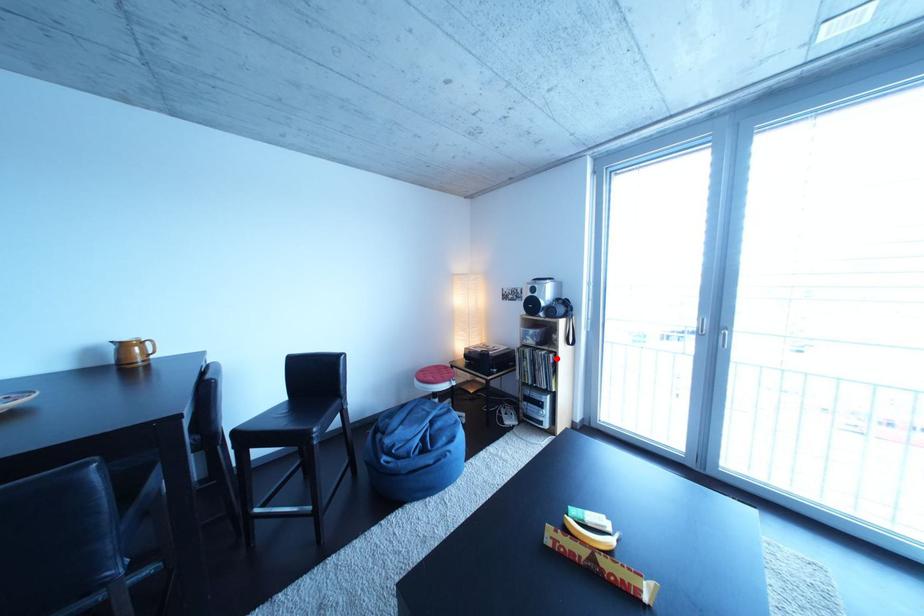
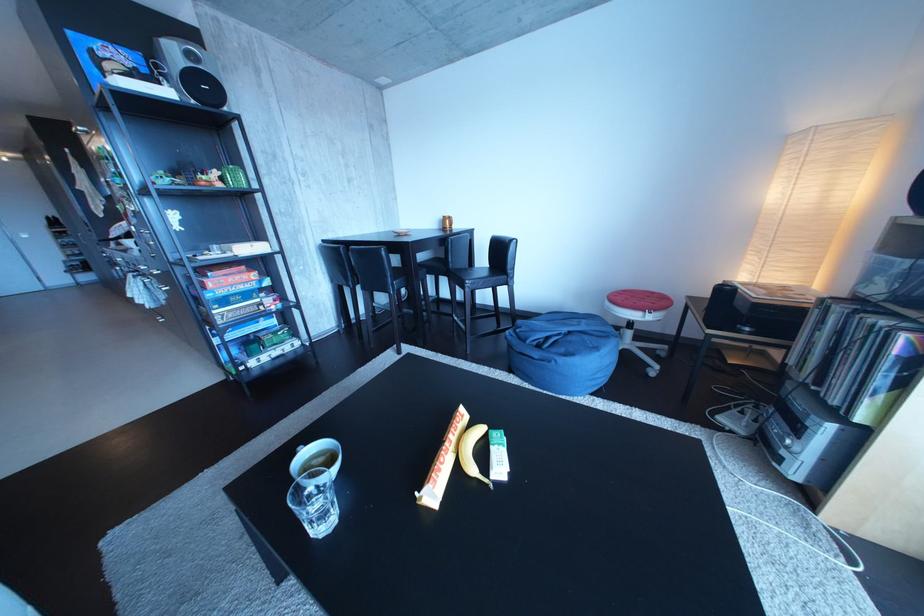
Where in the second image is the point corresponding to the highlighted location from the first image?

(896, 328)